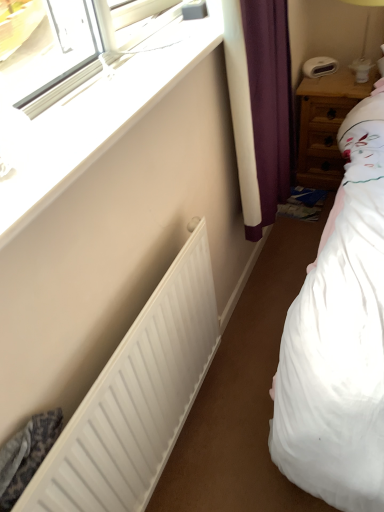
Question: Can you confirm if wooden nightstand at right is smaller than white matte radiator at lower left?

Choices:
 (A) no
 (B) yes

Answer: (A)

Question: Can white matte radiator at lower left be found inside wooden nightstand at right?

Choices:
 (A) yes
 (B) no

Answer: (B)

Question: Is wooden nightstand at right with white matte radiator at lower left?

Choices:
 (A) no
 (B) yes

Answer: (A)

Question: Can you confirm if wooden nightstand at right is taller than white matte radiator at lower left?

Choices:
 (A) yes
 (B) no

Answer: (B)

Question: Would you say wooden nightstand at right is outside white matte radiator at lower left?

Choices:
 (A) yes
 (B) no

Answer: (A)

Question: Is wooden nightstand at right wider than white matte radiator at lower left?

Choices:
 (A) yes
 (B) no

Answer: (A)

Question: From the image's perspective, is wooden nightstand at right below white plastic bedside lamp at upper right?

Choices:
 (A) no
 (B) yes

Answer: (B)

Question: From a real-world perspective, is wooden nightstand at right on top of white plastic bedside lamp at upper right?

Choices:
 (A) no
 (B) yes

Answer: (A)

Question: From a real-world perspective, is wooden nightstand at right located beneath white plastic bedside lamp at upper right?

Choices:
 (A) yes
 (B) no

Answer: (A)

Question: Does wooden nightstand at right touch white plastic bedside lamp at upper right?

Choices:
 (A) yes
 (B) no

Answer: (B)

Question: Is wooden nightstand at right bigger than white plastic bedside lamp at upper right?

Choices:
 (A) no
 (B) yes

Answer: (B)

Question: Is the position of wooden nightstand at right more distant than that of white plastic bedside lamp at upper right?

Choices:
 (A) no
 (B) yes

Answer: (B)

Question: Does white plastic bedside lamp at upper right come behind wooden nightstand at right?

Choices:
 (A) no
 (B) yes

Answer: (A)